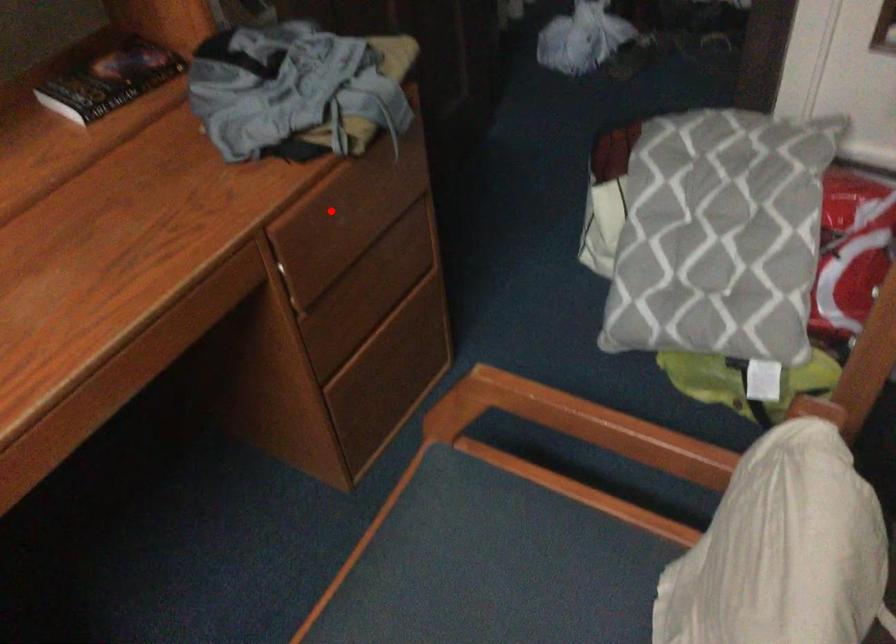
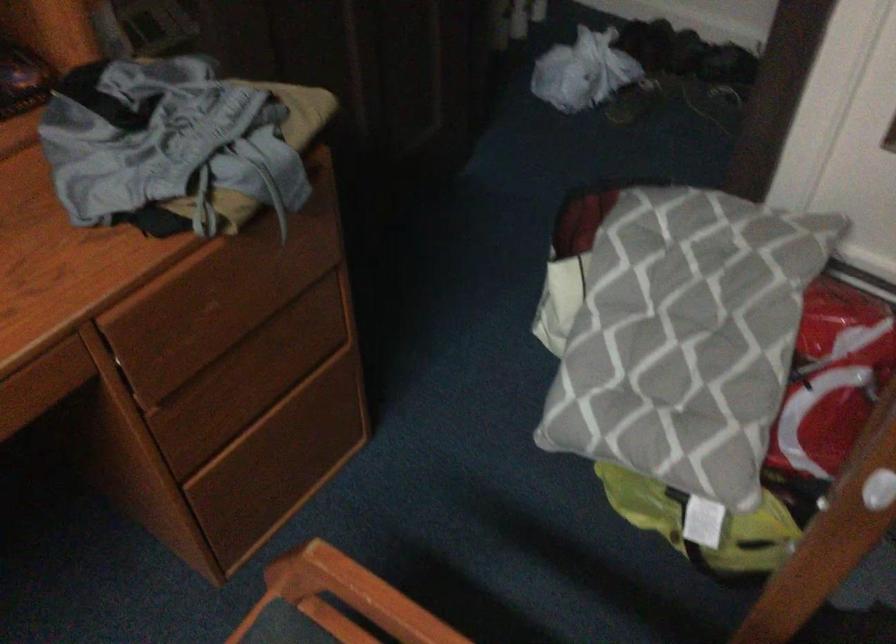
Question: I am providing you with two images of the same scene from different viewpoints. In image1, a red point is highlighted. Considering the same 3D point in image2, which of the following is correct?

Choices:
 (A) It is closer
 (B) It is farther

Answer: (A)